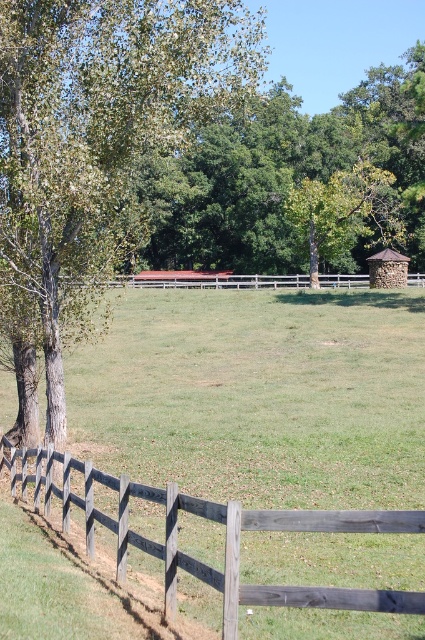
Based on the photo, you are a gardener planning to plant a new tree that requires at least 15 meters of space between it and any existing structures. You see the green leafy tree at left and the wooden fence at center. Can you plant your new tree between them without violating the spacing requirement?

The distance between the green leafy tree at left and the wooden fence at center is 14.21 meters, which is less than the required 15 meters. Therefore, planting the new tree between them would not meet the spacing requirement.

You are standing at the center of the field and want to walk towards the green leafy tree at left. Which direction should you face to head directly towards it?

The green leafy tree at left is located at point 0.222 on the x and 0.233 on the y axis, so you should face towards the left and slightly forward to head directly towards it.